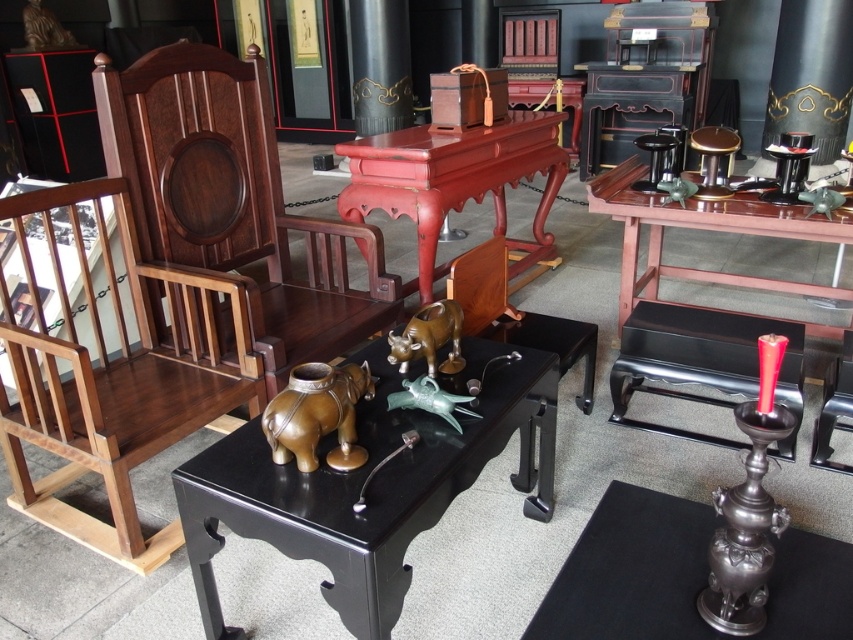
You are a delivery person who needs to place a large package on the surface of the black lacquered table at center and the polished wood chair at center. Which surface can you place the package on without it touching the floor?

The black lacquered table at center has a greater height compared to polished wood chair at center, so placing the package on the black lacquered table at center would keep it higher off the ground and prevent it from touching the floor.

You are a delivery person who needs to place a package that is 20 inches long between the black lacquered table at center and the polished wood chair at center. Is there enough space to fit the package horizontally between them?

The distance between the black lacquered table at center and the polished wood chair at center is 20.23 inches. Since the package is 20 inches long, there is enough space to fit it horizontally between them as the available space is slightly larger than the package.

You are arranging a display in an Asian art gallery. You need to place a tall decorative vase between the black lacquered table at center and the shiny dark wood table at right. According to the scene description, where should you place the vase so it is between them?

The black lacquered table at center is located below the shiny dark wood table at right. To place the vase between them, position it in the space between the lower black lacquered table at center and the higher shiny dark wood table at right, ensuring it sits vertically between their positions.